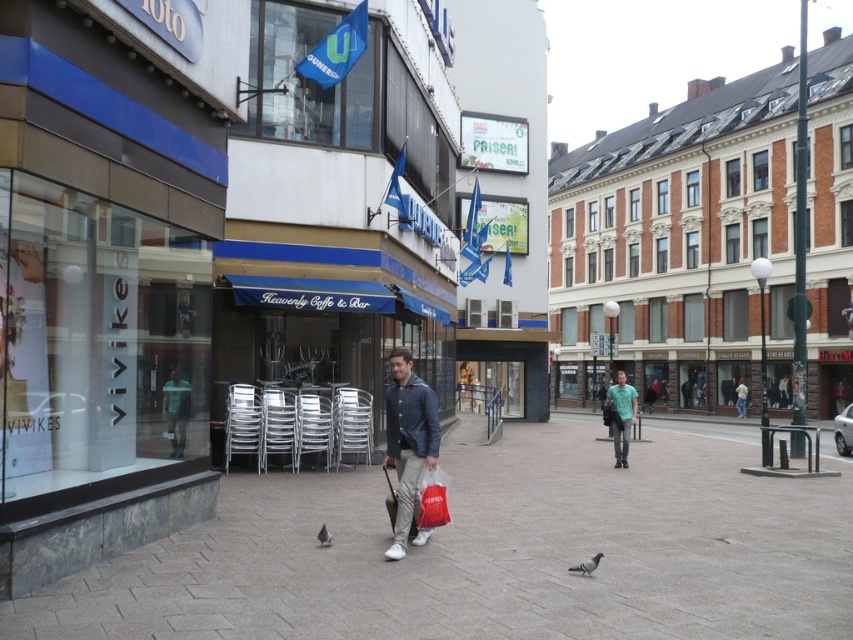
How much distance is there between smooth concrete pavement at center and brown brick building at center?

smooth concrete pavement at center and brown brick building at center are 27.45 meters apart.

Is smooth concrete pavement at center shorter than brown brick building at center?

Indeed, smooth concrete pavement at center has a lesser height compared to brown brick building at center.

Image resolution: width=853 pixels, height=640 pixels. Describe the element at coordinates (494, 550) in the screenshot. I see `smooth concrete pavement at center` at that location.

Identify the location of smooth concrete pavement at center. The width and height of the screenshot is (853, 640). (494, 550).

Is smooth concrete pavement at center positioned in front of green cotton t-shirt at center?

Yes, smooth concrete pavement at center is in front of green cotton t-shirt at center.

Does smooth concrete pavement at center appear under green cotton t-shirt at center?

Correct, smooth concrete pavement at center is located below green cotton t-shirt at center.

Locate an element on the screen. The height and width of the screenshot is (640, 853). smooth concrete pavement at center is located at coordinates (494, 550).

Where is `smooth concrete pavement at center`? This screenshot has width=853, height=640. smooth concrete pavement at center is located at coordinates (494, 550).

Consider the image. Can you confirm if green cotton t-shirt at center is thinner than gray matte pigeon at center?

No, green cotton t-shirt at center is not thinner than gray matte pigeon at center.

Does green cotton t-shirt at center have a greater height compared to gray matte pigeon at center?

Yes.

Find the location of a particular element. The width and height of the screenshot is (853, 640). green cotton t-shirt at center is located at coordinates (621, 417).

Where is `green cotton t-shirt at center`? This screenshot has height=640, width=853. green cotton t-shirt at center is located at coordinates (621, 417).